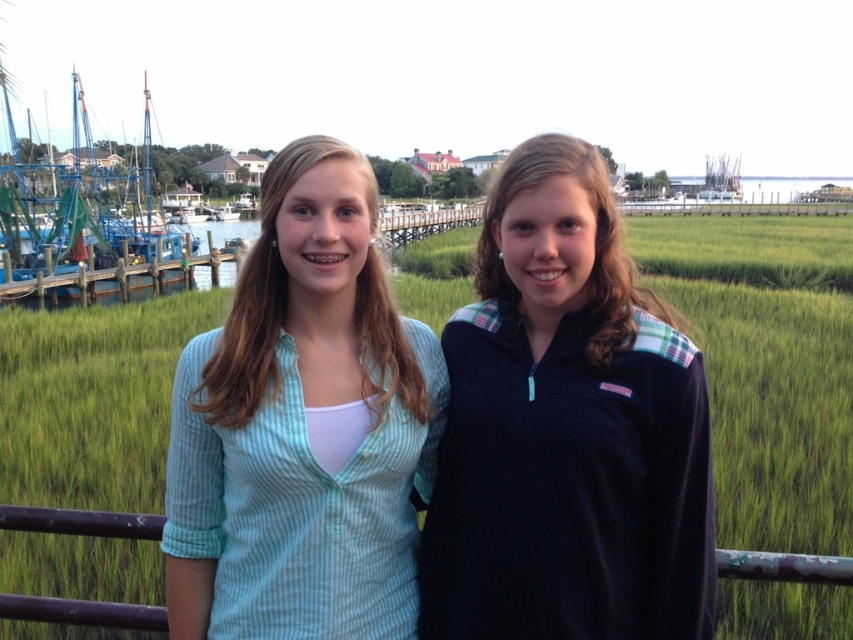
Question: Does light blue striped shirt at center have a larger size compared to blue painted wooden boat at left?

Choices:
 (A) no
 (B) yes

Answer: (A)

Question: Which object is farther from the camera taking this photo?

Choices:
 (A) light blue striped shirt at center
 (B) navy blue fleece at center
 (C) green grass at center
 (D) blue painted wooden boat at left

Answer: (D)

Question: Which object is closer to the camera taking this photo?

Choices:
 (A) navy blue fleece at center
 (B) blue painted wooden boat at left
 (C) green grass at center
 (D) light blue striped shirt at center

Answer: (A)

Question: Is navy blue fleece at center closer to camera compared to brown wooden fence at lower center?

Choices:
 (A) no
 (B) yes

Answer: (A)

Question: Can you confirm if light blue striped shirt at center is positioned to the right of brown wooden fence at lower center?

Choices:
 (A) no
 (B) yes

Answer: (A)

Question: Which is farther from the light blue striped shirt at center?

Choices:
 (A) green grass at center
 (B) navy blue fleece at center

Answer: (A)